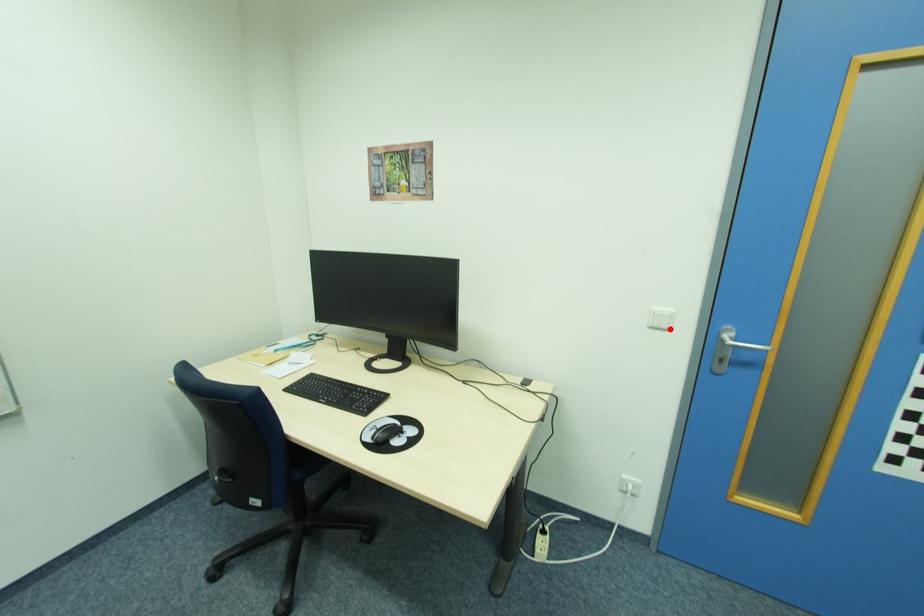
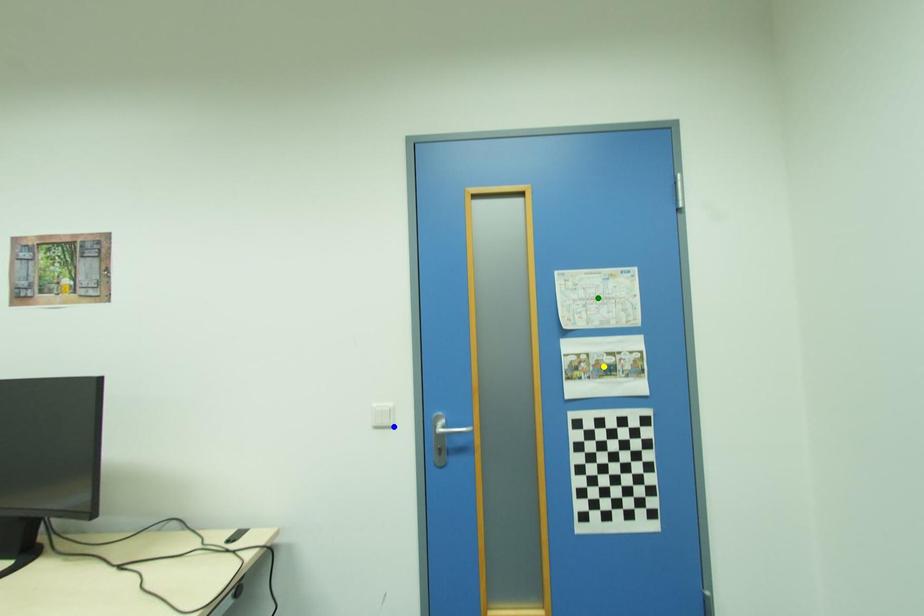
Question: I am providing you with two images of the same scene from different viewpoints. A red point is marked on the first image. You are given multiple points on the second image. Which point in image 2 is actually the same real-world point as the red point in image 1?

Choices:
 (A) blue point
 (B) yellow point
 (C) green point

Answer: (A)